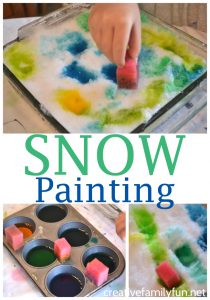
The width and height of the screenshot is (210, 300). Find the location of `green paint`. green paint is located at coordinates (42, 253).